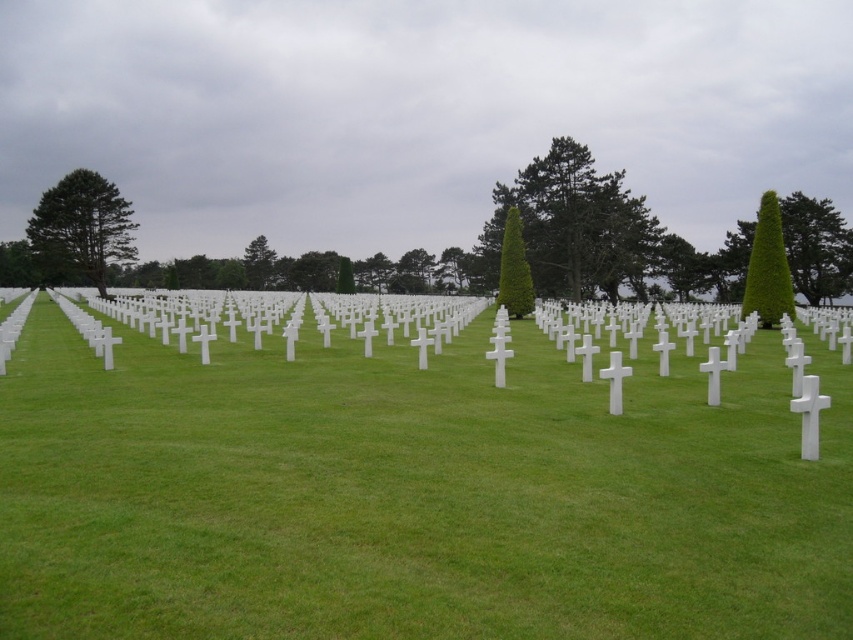
You are a groundskeeper planning to water the green grassy at center and the green leafy tree at center. The water sprinkler can cover up to 100 meters. Can you water both areas with one pass of the sprinkler?

The green grassy at center is 108.45 meters away from the green leafy tree at center. Since the sprinkler can only cover up to 100 meters, it cannot reach both areas in one pass. You would need to move the sprinkler closer to either the green grassy at center or the green leafy tree at center to ensure proper watering.

You are standing at the entrance of the cemetery and want to take a photo that includes both the point at coordinates point (x=782, y=269) and point (x=519, y=230). Which point will appear larger in your photo?

Point (x=782, y=269) is closer to the camera than point (x=519, y=230), so it will appear larger in the photo.

You are a groundskeeper in the cemetery and need to trim the green leafy tree at right and the green leafy hedge at center. If you start from the front, which one should you trim first?

The green leafy tree at right is in front of the green leafy hedge at center, so you should trim the green leafy tree at right first since it is closer to you.